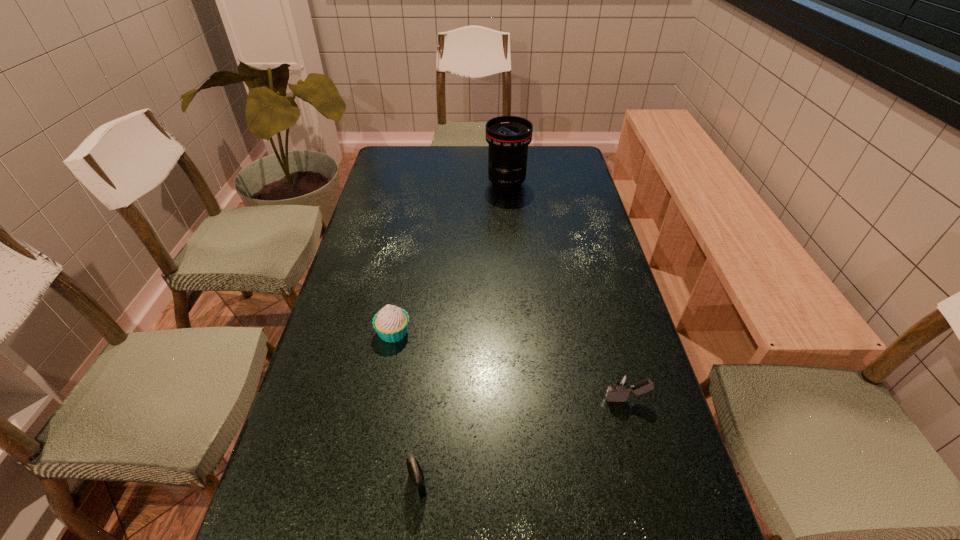
At what (x,y) coordinates should I click in order to perform the action: click on vacant space located on the back of the rightmost object. Please return your answer as a coordinate pair (x, y). This screenshot has height=540, width=960. Looking at the image, I should click on (610, 338).

You are a GUI agent. You are given a task and a screenshot of the screen. Output one action in this format:
    pyautogui.click(x=<x>, y=<y>)
    Task: Click on the free space located on the right of the nearest object
    
    Given the screenshot: What is the action you would take?
    pyautogui.click(x=621, y=483)

Where is `object that is at the far edge`? object that is at the far edge is located at coordinates (508, 137).

The width and height of the screenshot is (960, 540). Find the location of `object that is at the left edge`. object that is at the left edge is located at coordinates (391, 323).

You are a GUI agent. You are given a task and a screenshot of the screen. Output one action in this format:
    pyautogui.click(x=<x>, y=<y>)
    Task: Click on the object at the right edge
    Image resolution: width=960 pixels, height=540 pixels.
    Given the screenshot: What is the action you would take?
    pyautogui.click(x=621, y=385)

Where is `vacant area at the far edge`? Image resolution: width=960 pixels, height=540 pixels. vacant area at the far edge is located at coordinates [484, 174].

The width and height of the screenshot is (960, 540). Identify the location of free space at the left edge. (378, 204).

Locate an element on the screen. The height and width of the screenshot is (540, 960). blank space at the right edge is located at coordinates (610, 361).

In the image, there is a desktop. Where is `vacant space at the far left corner`? vacant space at the far left corner is located at coordinates (382, 174).

The width and height of the screenshot is (960, 540). In order to click on free space that is in between the rightmost object and the leftmost object in this screenshot , I will do `click(510, 366)`.